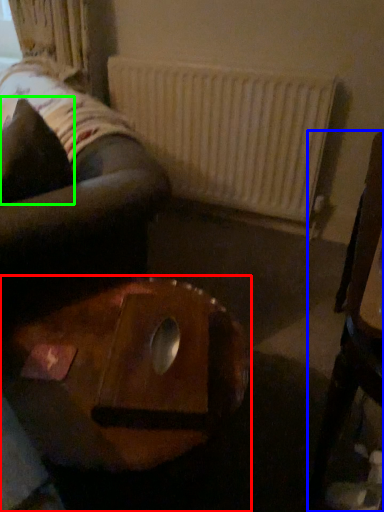
Question: Estimate the real-world distances between objects in this image. Which object is farther from table (highlighted by a red box), furniture (highlighted by a blue box) or pillow (highlighted by a green box)?

Choices:
 (A) furniture
 (B) pillow

Answer: (B)